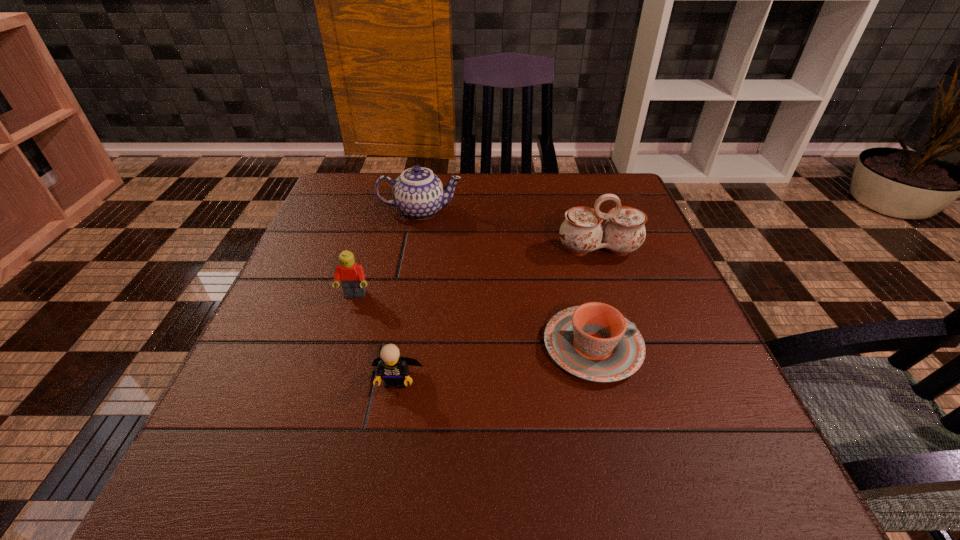
Identify the location of vacant space that is in between the second farthest chinaware and the farthest chinaware. point(510,231).

Identify the location of vacant region between the leftmost chinaware and the fourth nearest object. [x=510, y=231].

Find the location of a particular element. The image size is (960, 540). vacant area between the nearer Lego and the farthest object is located at coordinates (408, 296).

You are a GUI agent. You are given a task and a screenshot of the screen. Output one action in this format:
    pyautogui.click(x=<x>, y=<y>)
    Task: Click on the free space between the second farthest chinaware and the fourth tallest object
    The image size is (960, 540).
    Given the screenshot: What is the action you would take?
    pyautogui.click(x=497, y=315)

The height and width of the screenshot is (540, 960). What are the coordinates of `object that is the nearest to the second farthest chinaware` in the screenshot? It's located at (594, 341).

Locate which object ranks third in proximity to the shorter Lego. Please provide its 2D coordinates. Your answer should be formatted as a tuple, i.e. [(x, y)], where the tuple contains the x and y coordinates of a point satisfying the conditions above.

[(581, 232)]

Select which chinaware appears as the second closest to the left Lego. Please provide its 2D coordinates. Your answer should be formatted as a tuple, i.e. [(x, y)], where the tuple contains the x and y coordinates of a point satisfying the conditions above.

[(594, 341)]

Locate an element on the screen. This screenshot has height=540, width=960. chinaware identified as the second closest to the second nearest chinaware is located at coordinates (418, 193).

In order to click on vacant space that satisfies the following two spatial constraints: 1. by the handle of the second nearest chinaware; 2. on the handle side of the nearest chinaware in this screenshot , I will do `click(631, 346)`.

Identify the location of free spot that satisfies the following two spatial constraints: 1. by the handle of the second nearest chinaware; 2. on the handle side of the shortest object. The height and width of the screenshot is (540, 960). click(x=631, y=346).